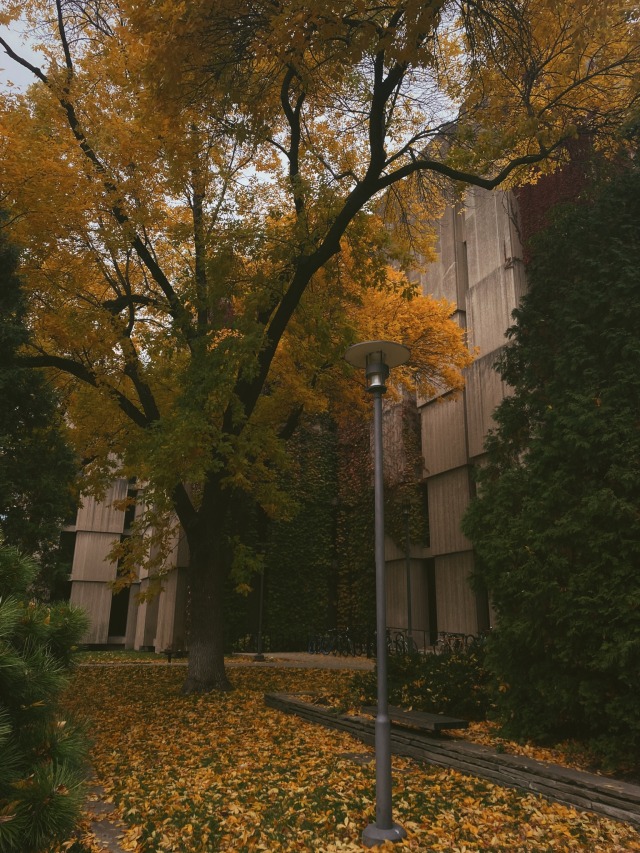
At what (x,y) coordinates should I click in order to perform the action: click on lamp. Please return your answer as a coordinate pair (x, y). Image resolution: width=640 pixels, height=853 pixels. Looking at the image, I should click on (384, 755), (257, 639), (408, 623).